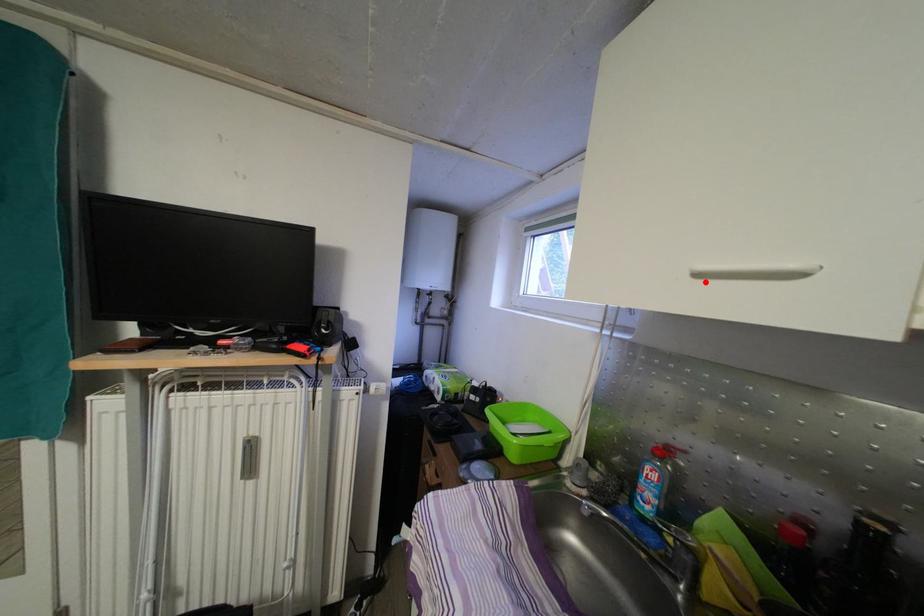
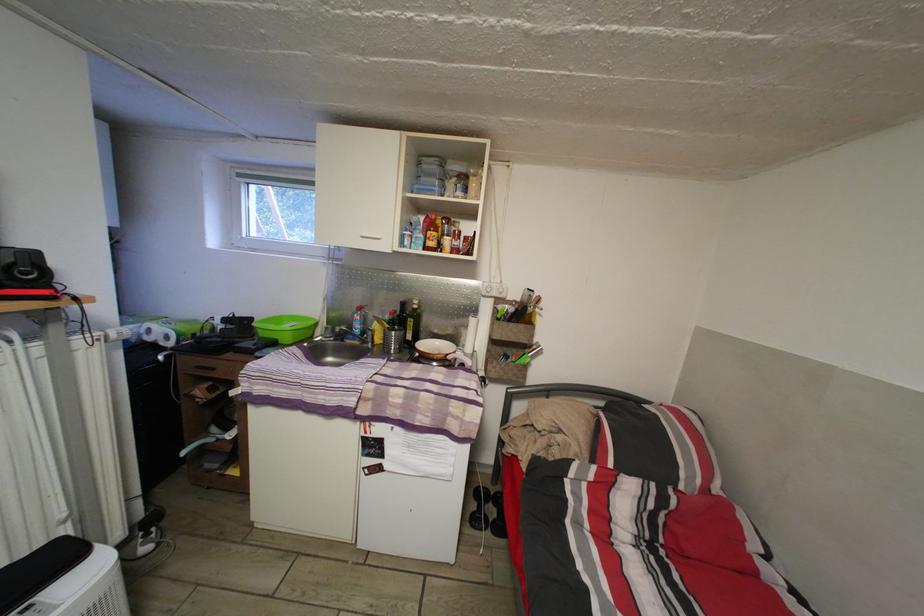
In the second image, find the point that corresponds to the highlighted location in the first image.

(370, 244)